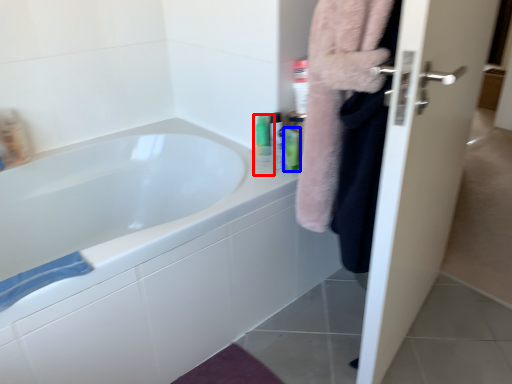
Question: Among these objects, which one is nearest to the camera, mouthwash (highlighted by a red box) or mouthwash (highlighted by a blue box)?

Choices:
 (A) mouthwash
 (B) mouthwash

Answer: (B)